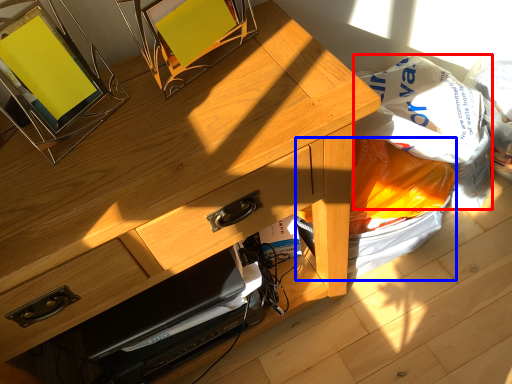
Question: Which of the following is the farthest to the observer, grocery bag (highlighted by a red box) or garbage (highlighted by a blue box)?

Choices:
 (A) grocery bag
 (B) garbage

Answer: (B)